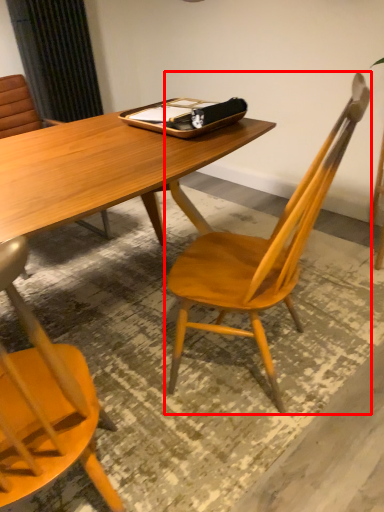
Question: From the image's perspective, considering the relative positions of chair (annotated by the red box) and tray in the image provided, where is chair (annotated by the red box) located with respect to the staircase?

Choices:
 (A) above
 (B) below

Answer: (B)